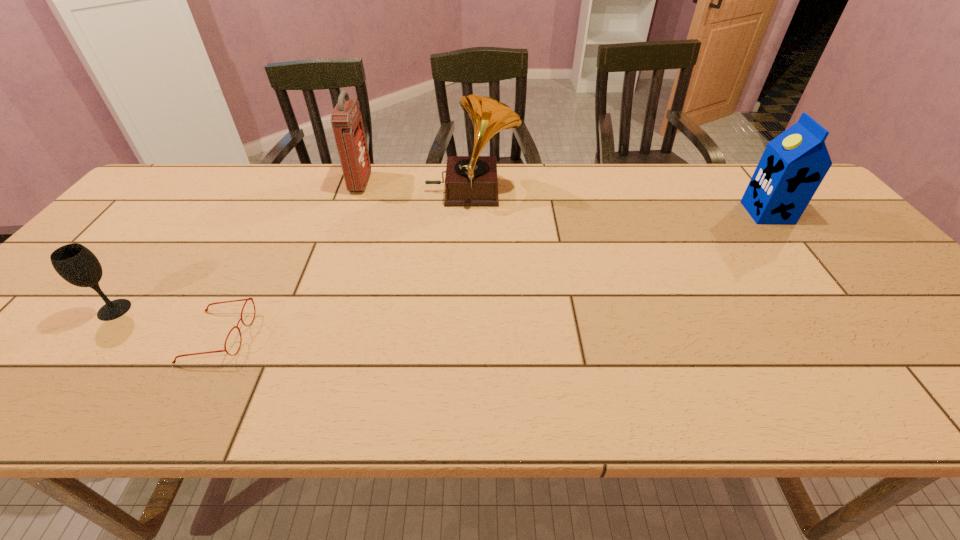
Find the location of a particular element. unoccupied position between the first-aid kit and the second object from right to left is located at coordinates (416, 188).

What are the coordinates of `vacant region between the shortest object and the leftmost object` in the screenshot? It's located at (166, 323).

Find the location of a particular element. free space between the fourth tallest object and the fourth object from right to left is located at coordinates (166, 323).

Where is `blank region between the second object from right to left and the spectacles`? The height and width of the screenshot is (540, 960). blank region between the second object from right to left and the spectacles is located at coordinates (345, 264).

Choose which object is the third nearest neighbor to the shortest object. Please provide its 2D coordinates. Your answer should be formatted as a tuple, i.e. [(x, y)], where the tuple contains the x and y coordinates of a point satisfying the conditions above.

[(472, 180)]

Locate which object is the second closest to the first-aid kit. Please provide its 2D coordinates. Your answer should be formatted as a tuple, i.e. [(x, y)], where the tuple contains the x and y coordinates of a point satisfying the conditions above.

[(247, 299)]